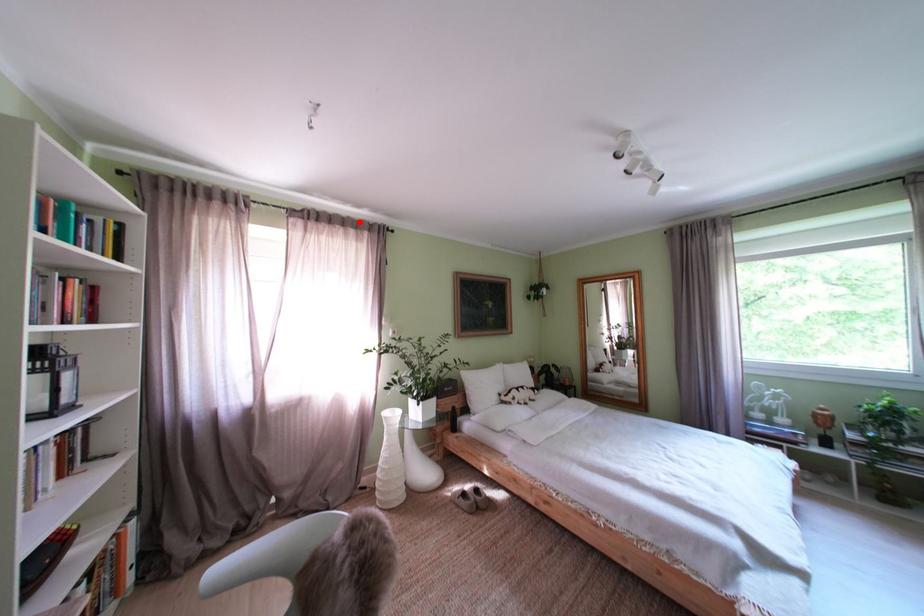
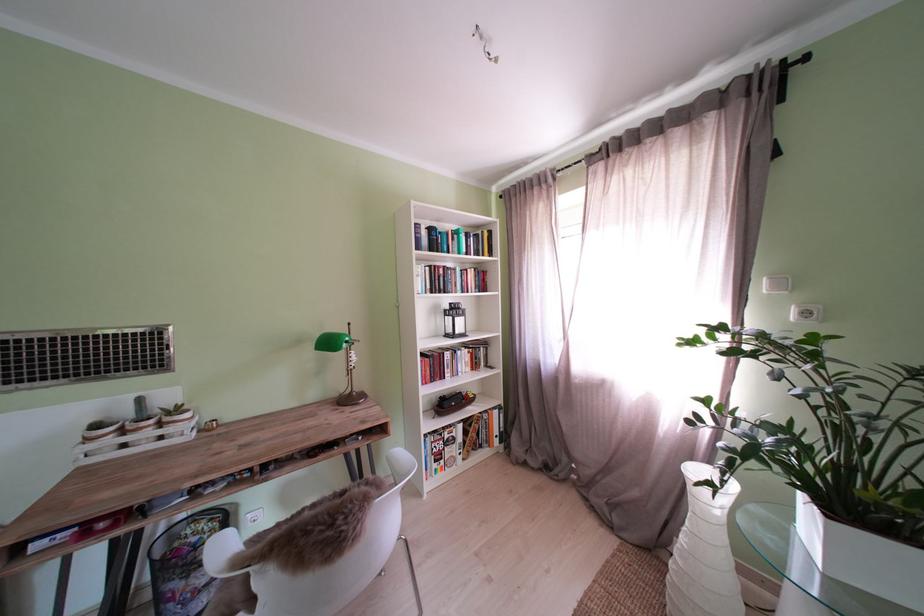
Where in the second image is the point corresponding to the highlighted location from the first image?

(681, 116)